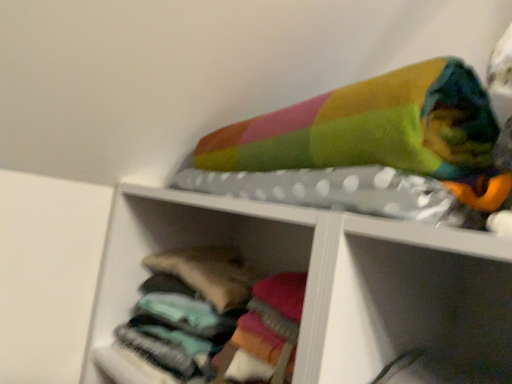
This screenshot has width=512, height=384. In order to click on soft cotton socks at lower left in this screenshot , I will do `click(218, 318)`.

The height and width of the screenshot is (384, 512). Describe the element at coordinates (218, 318) in the screenshot. I see `soft cotton socks at lower left` at that location.

In order to click on soft cotton socks at lower left in this screenshot , I will do `click(218, 318)`.